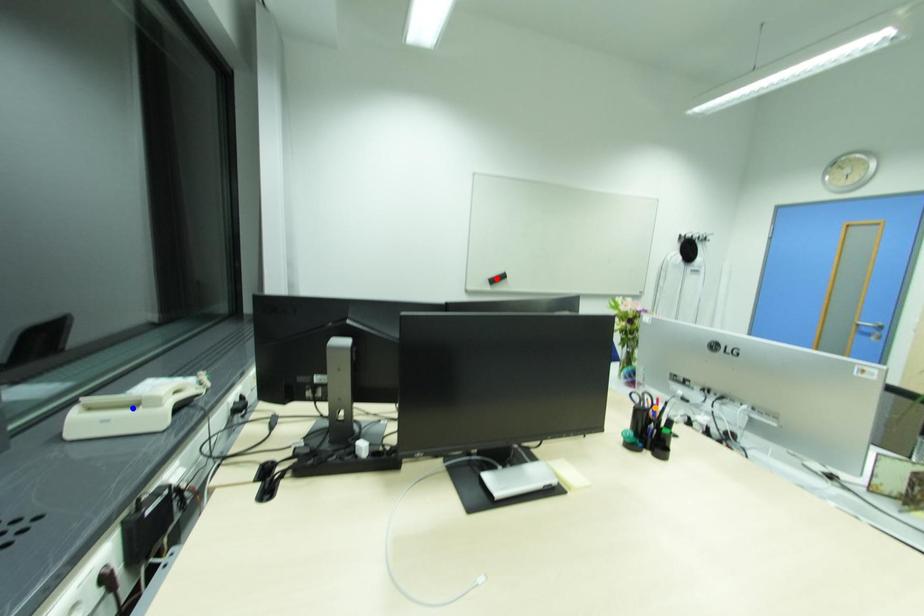
Order these from nearest to farthest:
blue point | red point | orange point

red point
orange point
blue point